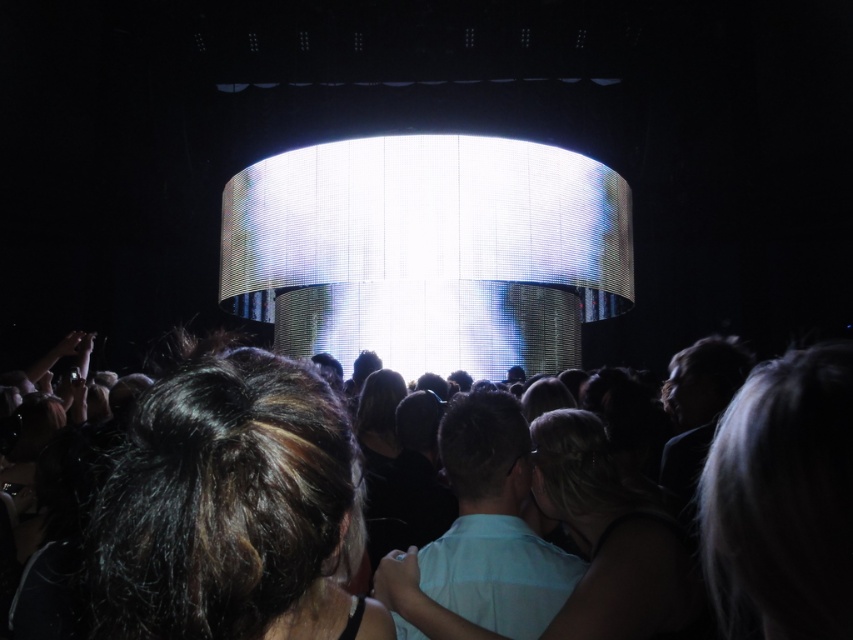
Question: Does silvery hair at center lie in front of light blue fabric at center?

Choices:
 (A) yes
 (B) no

Answer: (A)

Question: Based on their relative distances, which object is farther from the light blue fabric at center?

Choices:
 (A) dark brown hair at center
 (B) silvery hair at center
 (C) dark hair at center
 (D) blonde hair at center

Answer: (B)

Question: Can you confirm if blonde hair at center is wider than light blue fabric at center?

Choices:
 (A) no
 (B) yes

Answer: (A)

Question: Which of the following is the farthest from the observer?

Choices:
 (A) (625, 536)
 (B) (224, 449)
 (C) (703, 547)

Answer: (A)

Question: Which object is farther from the camera taking this photo?

Choices:
 (A) silvery hair at center
 (B) dark brown hair at center

Answer: (A)

Question: Does silvery hair at center come in front of light blue fabric at center?

Choices:
 (A) no
 (B) yes

Answer: (B)